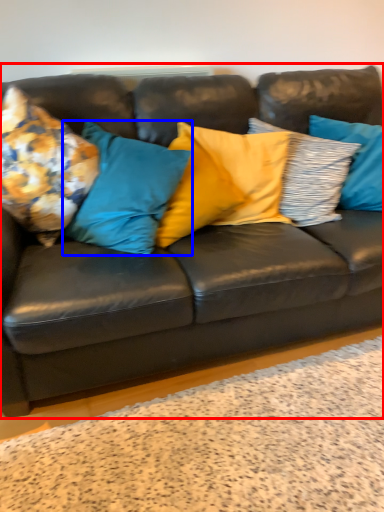
Question: Which object is closer to the camera taking this photo, studio couch (highlighted by a red box) or pillow (highlighted by a blue box)?

Choices:
 (A) studio couch
 (B) pillow

Answer: (A)